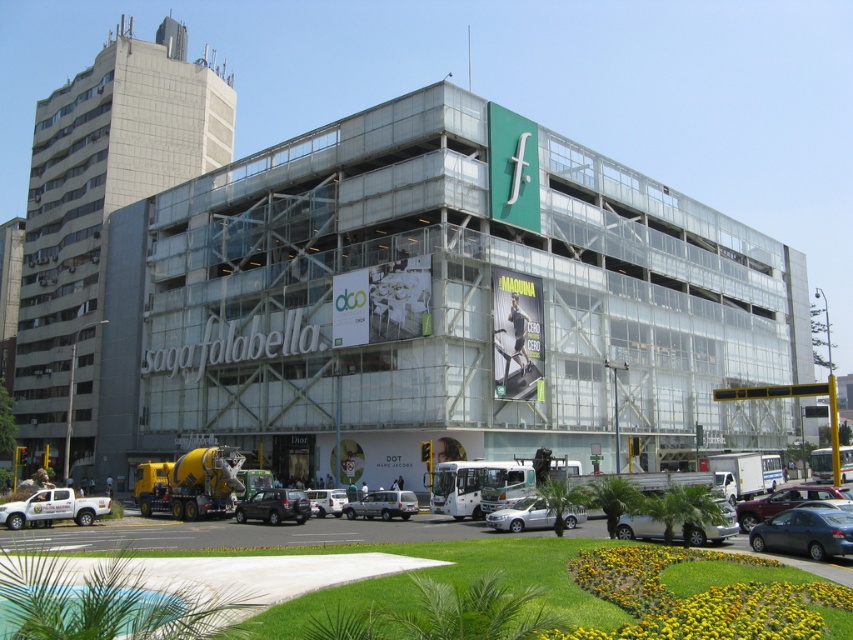
Is silver metallic sedan at lower center wider than satin black car at center?

Correct, the width of silver metallic sedan at lower center exceeds that of satin black car at center.

Between silver metallic sedan at lower center and satin black car at center, which one appears on the right side from the viewer's perspective?

From the viewer's perspective, silver metallic sedan at lower center appears more on the right side.

Does point (727, 515) come behind point (305, 497)?

No, it is not.

Where is `silver metallic sedan at lower center`? The width and height of the screenshot is (853, 640). silver metallic sedan at lower center is located at coordinates (717, 525).

How much distance is there between transparent glass scaffolding at center and silver metallic sedan at lower center?

transparent glass scaffolding at center and silver metallic sedan at lower center are 45.39 meters apart.

Can you confirm if transparent glass scaffolding at center is positioned to the left of silver metallic sedan at lower center?

In fact, transparent glass scaffolding at center is to the right of silver metallic sedan at lower center.

Is point (192, 289) positioned before point (653, 529)?

No, (192, 289) is further to viewer.

Locate an element on the screen. The image size is (853, 640). transparent glass scaffolding at center is located at coordinates (437, 308).

Who is more forward, (480, 230) or (387, 509)?

Positioned in front is point (387, 509).

Is point (346, 195) positioned after point (354, 515)?

That is True.

Identify the location of transparent glass scaffolding at center. (437, 308).